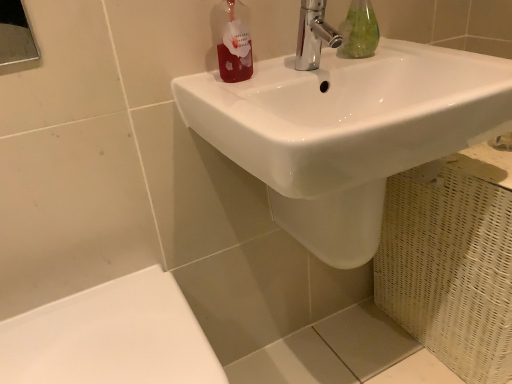
I want to click on vacant area located to the right-hand side of green glass bottle at upper center, so click(415, 52).